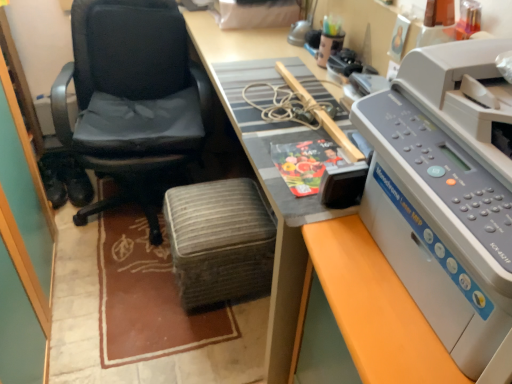
What do you see at coordinates (132, 97) in the screenshot? I see `black leather chair at left` at bounding box center [132, 97].

Image resolution: width=512 pixels, height=384 pixels. What do you see at coordinates (147, 296) in the screenshot? I see `brown woven mat at lower left` at bounding box center [147, 296].

In order to click on brown woven mat at lower left in this screenshot , I will do `click(147, 296)`.

What is the approximate height of black leather shoes at left?

15.21 centimeters.

At what (x,y) coordinates should I click in order to perform the action: click on wooden desk at center. Please return your answer as a coordinate pair (x, y). The width and height of the screenshot is (512, 384). Looking at the image, I should click on (242, 59).

Is point (231, 264) farther from viewer compared to point (220, 338)?

No, it is in front of (220, 338).

Which is more to the right, woven fabric stool at center or brown woven mat at lower left?

woven fabric stool at center.

Considering the sizes of objects woven fabric stool at center and brown woven mat at lower left in the image provided, who is thinner, woven fabric stool at center or brown woven mat at lower left?

With smaller width is woven fabric stool at center.

Is black leather chair at left oriented towards black leather shoes at left?

No, black leather chair at left is not oriented towards black leather shoes at left.

In the scene shown: Is black leather chair at left taller or shorter than black leather shoes at left?

Considering their sizes, black leather chair at left has more height than black leather shoes at left.

Who is smaller, black leather chair at left or black leather shoes at left?

black leather shoes at left is smaller.

Is black leather chair at left in front of or behind black leather shoes at left in the image?

black leather chair at left is positioned closer to the viewer than black leather shoes at left.

In the image, is black leather chair at left positioned in front of or behind brown woven mat at lower left?

In the image, black leather chair at left appears in front of brown woven mat at lower left.

Can you tell me how much black leather chair at left and brown woven mat at lower left differ in facing direction?

4.37 degrees.

Can brown woven mat at lower left be found inside black leather chair at left?

No, brown woven mat at lower left is not a part of black leather chair at left.

In the scene shown: Considering the relative positions of black leather chair at left and brown woven mat at lower left in the image provided, is black leather chair at left to the left of brown woven mat at lower left from the viewer's perspective?

Yes, black leather chair at left is to the left of brown woven mat at lower left.

Based on the photo, is black leather shoes at left at the right side of black leather chair at left?

Incorrect, black leather shoes at left is not on the right side of black leather chair at left.

From a real-world perspective, which is physically below, black leather shoes at left or black leather chair at left?

black leather shoes at left is physically lower.

Does black leather shoes at left have a larger size compared to black leather chair at left?

No, black leather shoes at left is not bigger than black leather chair at left.

Which is more to the right, gray plastic printer at right or black leather chair at left?

Positioned to the right is gray plastic printer at right.

Can you confirm if gray plastic printer at right is shorter than black leather chair at left?

Correct, gray plastic printer at right is not as tall as black leather chair at left.

Is gray plastic printer at right oriented towards black leather chair at left?

No, gray plastic printer at right does not turn towards black leather chair at left.

In the scene shown: Is gray plastic printer at right completely or partially outside of black leather shoes at left?

Indeed, gray plastic printer at right is completely outside black leather shoes at left.

Is gray plastic printer at right not near black leather shoes at left?

gray plastic printer at right is positioned a significant distance from black leather shoes at left.

Identify the location of printer on the right side of black leather shoes at left. (443, 196).

Between gray plastic printer at right and black leather shoes at left, which one has larger width?

gray plastic printer at right.

Which of these two, gray plastic printer at right or brown woven mat at lower left, stands taller?

gray plastic printer at right is taller.

Considering the relative positions of gray plastic printer at right and brown woven mat at lower left in the image provided, is gray plastic printer at right to the left of brown woven mat at lower left from the viewer's perspective?

Incorrect, gray plastic printer at right is not on the left side of brown woven mat at lower left.

Is brown woven mat at lower left inside gray plastic printer at right?

No, brown woven mat at lower left is not a part of gray plastic printer at right.

From the picture: Does gray plastic printer at right have a greater width compared to brown woven mat at lower left?

In fact, gray plastic printer at right might be narrower than brown woven mat at lower left.

This screenshot has height=384, width=512. I want to click on mat that appears on the left of woven fabric stool at center, so click(147, 296).

The width and height of the screenshot is (512, 384). I want to click on chair that appears in front of the black leather shoes at left, so click(x=132, y=97).

Considering their positions, is wooden desk at center positioned closer to black leather shoes at left than woven fabric stool at center?

woven fabric stool at center lies closer to black leather shoes at left than the other object.

Based on their spatial positions, is woven fabric stool at center or black leather chair at left further from wooden desk at center?

black leather chair at left lies further to wooden desk at center than the other object.

From the image, which object appears to be farther from gray plastic printer at right, black leather chair at left or black leather shoes at left?

black leather shoes at left lies further to gray plastic printer at right than the other object.

Based on their spatial positions, is black leather shoes at left or gray plastic printer at right closer to black leather chair at left?

black leather shoes at left lies closer to black leather chair at left than the other object.

Looking at the image, which one is located closer to black leather shoes at left, black leather chair at left or wooden desk at center?

black leather chair at left is closer to black leather shoes at left.

Which object lies nearer to the anchor point wooden desk at center, woven fabric stool at center or gray plastic printer at right?

gray plastic printer at right is closer to wooden desk at center.

Looking at the image, which one is located closer to gray plastic printer at right, black leather chair at left or woven fabric stool at center?

woven fabric stool at center lies closer to gray plastic printer at right than the other object.

When comparing their distances from black leather chair at left, does gray plastic printer at right or wooden desk at center seem further?

gray plastic printer at right.

Where is `mat situated between black leather chair at left and gray plastic printer at right from left to right`? mat situated between black leather chair at left and gray plastic printer at right from left to right is located at coordinates (147, 296).

In order to click on mat between black leather chair at left and wooden desk at center in this screenshot , I will do (147, 296).

You are a GUI agent. You are given a task and a screenshot of the screen. Output one action in this format:
    pyautogui.click(x=<x>, y=<y>)
    Task: Click on the desk located between black leather chair at left and gray plastic printer at right in the left-right direction
    This screenshot has height=384, width=512.
    Given the screenshot: What is the action you would take?
    pyautogui.click(x=242, y=59)

Locate an element on the screen. mat between wooden desk at center and black leather shoes at left in the front-back direction is located at coordinates (147, 296).